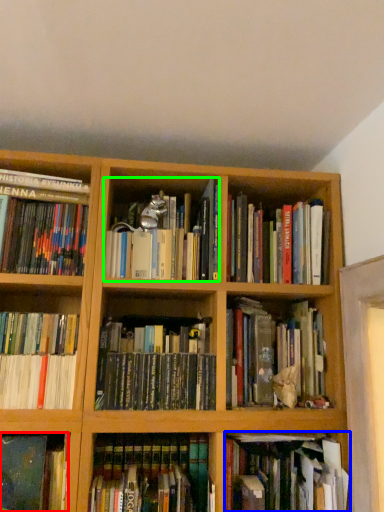
Question: Which object is the closest to the book (highlighted by a red box)? Choose among these: book (highlighted by a blue box) or book (highlighted by a green box).

Choices:
 (A) book
 (B) book

Answer: (A)